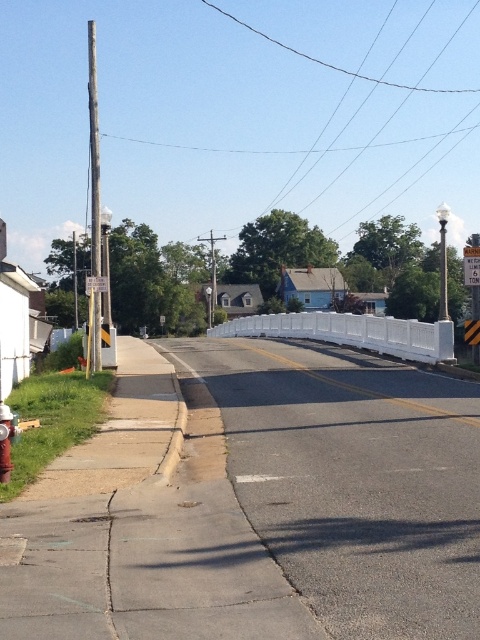
You are a delivery driver approaching the white plastic barricade at center and the red metallic hydrant at lower left. Which object is closer to the curb?

The red metallic hydrant at lower left is closer to the curb than the white plastic barricade at center because the white plastic barricade at center is positioned on the right side of the red metallic hydrant at lower left, meaning the red metallic hydrant is nearer to the curb.

You are a delivery driver with a 2.5 meter wide truck. You need to drive through the area between the white plastic barricade at center and the red metallic hydrant at lower left. Can your truck fit through the space between them?

The white plastic barricade at center might be wider than red metallic hydrant at lower left, so the truck with 2.5 meter width may or may not fit depending on the exact width difference. However, since the barricade could be wider, there is a risk of collision if the space is narrower than 2.5 meters. It is safer to avoid this route unless confirmed otherwise.

You are standing at the point closer to the camera between the two points, point [421,324] and point [3,452]. Which point are you standing at?

You are standing at point [3,452] because it is closer to the camera than point [421,324].